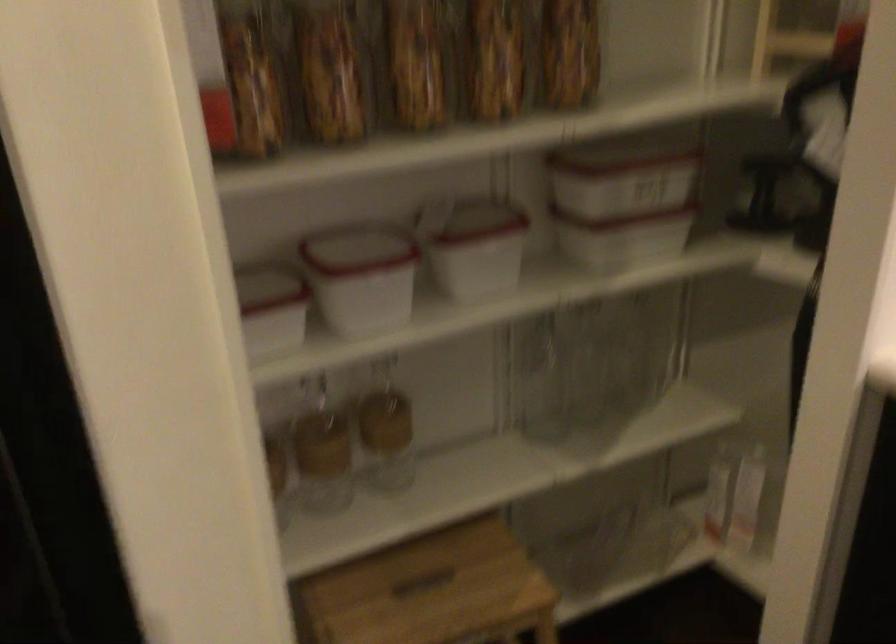
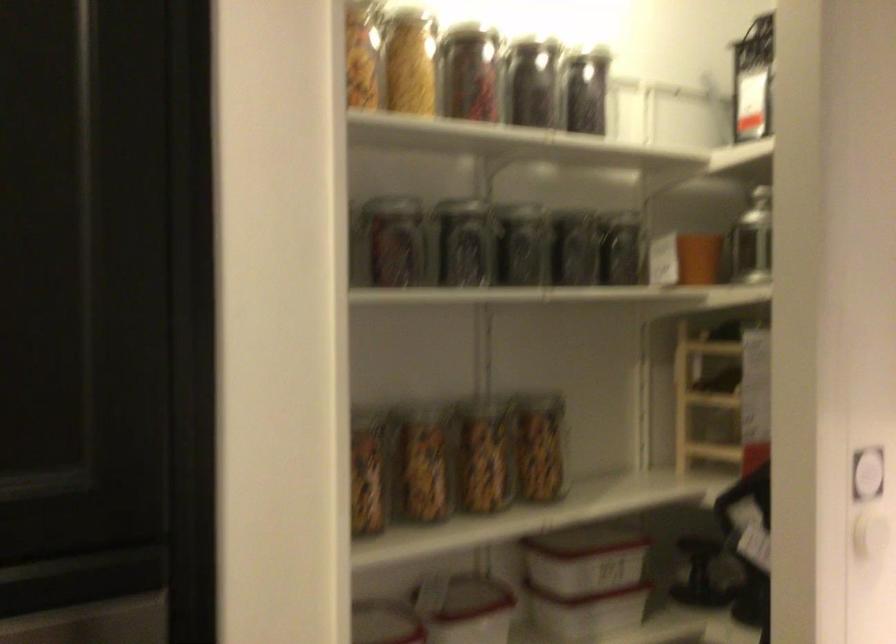
Find the pixel in the second image that matches point 383,249 in the first image.

(383, 623)